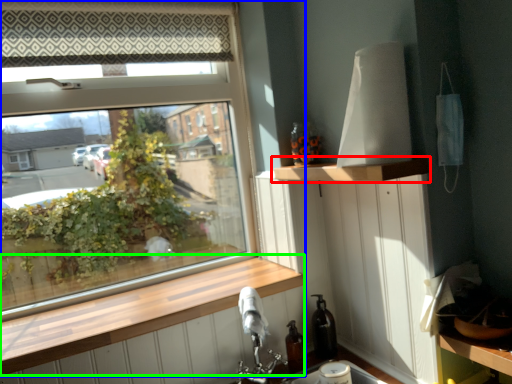
Question: Which object is the farthest from shelf (highlighted by a red box)? Choose among these: window (highlighted by a blue box) or window sill (highlighted by a green box).

Choices:
 (A) window
 (B) window sill

Answer: (A)